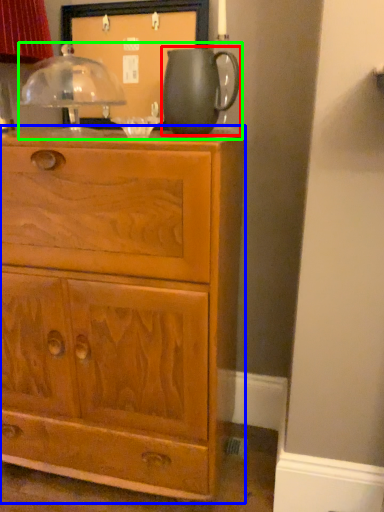
Question: Which object is the farthest from jug (highlighted by a red box)? Choose among these: chest of drawers (highlighted by a blue box) or tea set (highlighted by a green box).

Choices:
 (A) chest of drawers
 (B) tea set

Answer: (A)